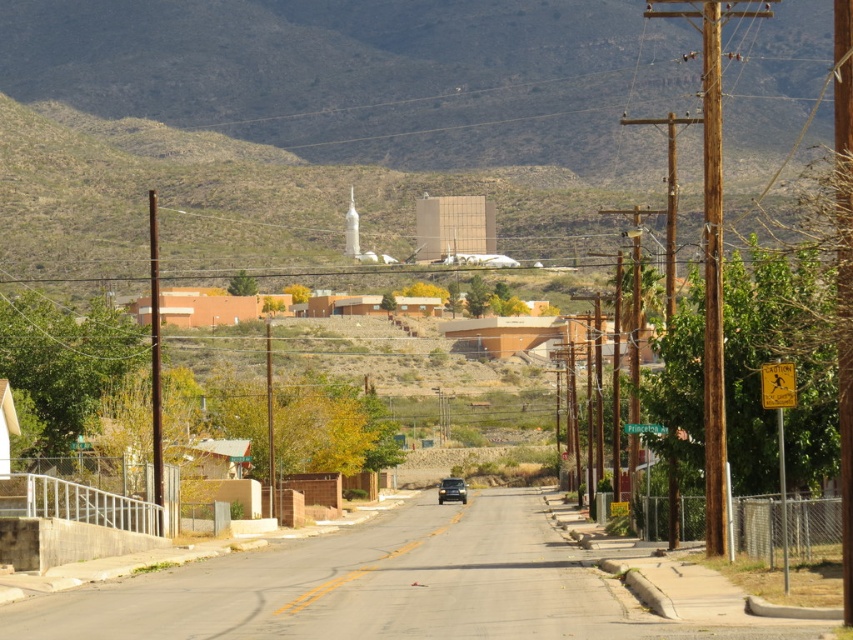
You are driving a car and see the brown rocky mountain at upper center and the metallic gold suv at center. Which object is closer to you?

The brown rocky mountain at upper center is closer to you because it is positioned in front of the metallic gold suv at center, indicating it is nearer in the scene.